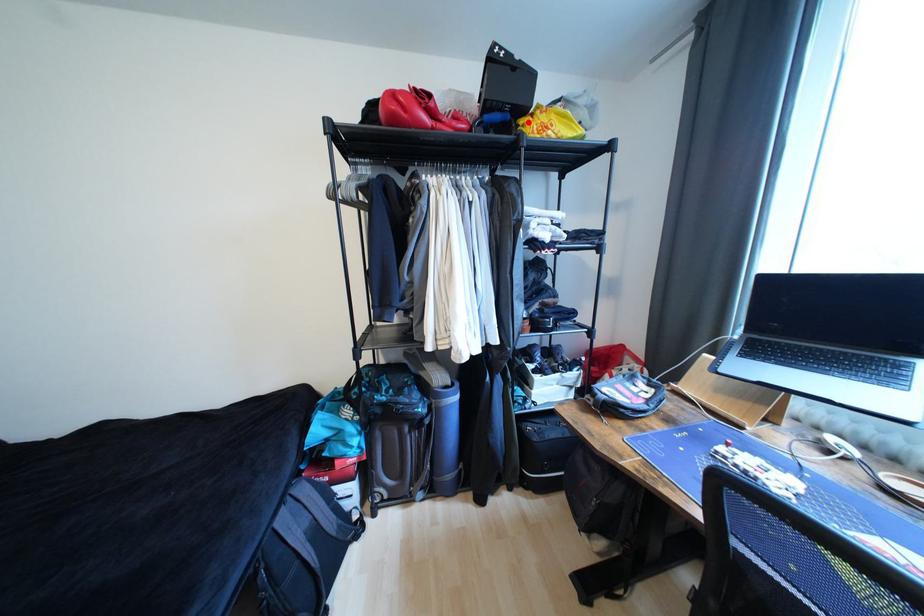
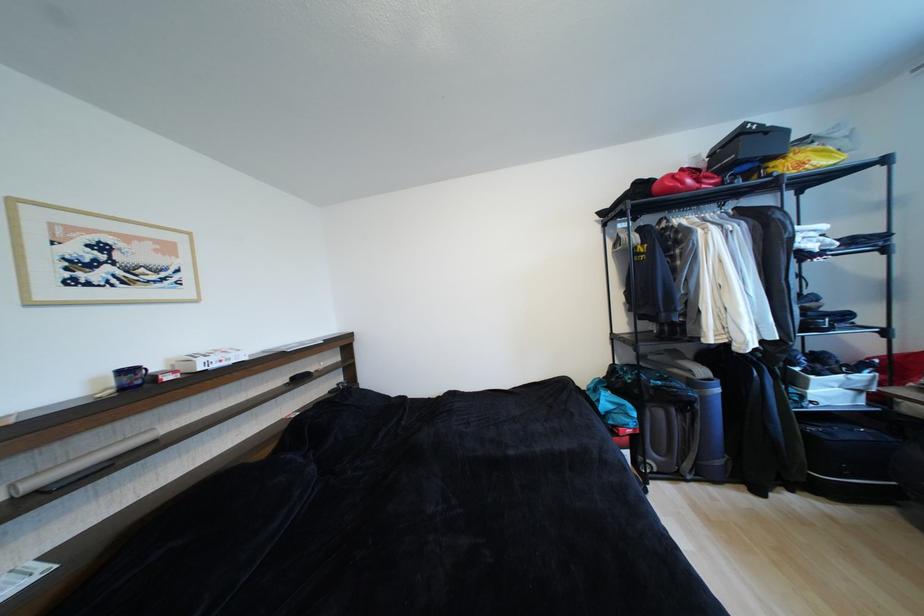
Where in the second image is the point corresponding to the highlighted location from the first image?

(780, 166)